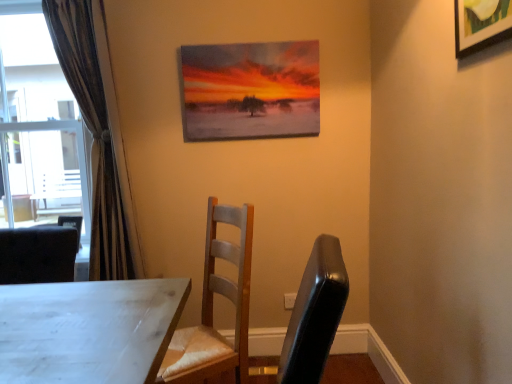
Question: Does wooden chair at center appear on the right side of oil painting at upper center, which appears as the 2th picture frame when viewed from the right?

Choices:
 (A) yes
 (B) no

Answer: (B)

Question: Is oil painting at upper center, the 1th picture frame positioned from the back, inside wooden chair at center?

Choices:
 (A) no
 (B) yes

Answer: (A)

Question: Is wooden chair at center shorter than oil painting at upper center, the 1th picture frame positioned from the back?

Choices:
 (A) no
 (B) yes

Answer: (A)

Question: Is wooden chair at center far away from oil painting at upper center, the 1th picture frame positioned from the back?

Choices:
 (A) yes
 (B) no

Answer: (B)

Question: Could you tell me if wooden chair at center is facing oil painting at upper center, acting as the second picture frame starting from the front?

Choices:
 (A) yes
 (B) no

Answer: (B)

Question: From the image's perspective, is wooden chair at center beneath oil painting at upper center, which appears as the 2th picture frame when viewed from the right?

Choices:
 (A) yes
 (B) no

Answer: (A)

Question: Can you confirm if transparent glass window at left is bigger than brown textured curtain at left?

Choices:
 (A) no
 (B) yes

Answer: (B)

Question: Considering the relative sizes of transparent glass window at left and brown textured curtain at left in the image provided, is transparent glass window at left taller than brown textured curtain at left?

Choices:
 (A) yes
 (B) no

Answer: (B)

Question: Is transparent glass window at left facing away from brown textured curtain at left?

Choices:
 (A) no
 (B) yes

Answer: (A)

Question: From the image's perspective, is transparent glass window at left under brown textured curtain at left?

Choices:
 (A) yes
 (B) no

Answer: (B)

Question: Does transparent glass window at left have a greater width compared to brown textured curtain at left?

Choices:
 (A) no
 (B) yes

Answer: (B)

Question: Is transparent glass window at left oriented towards brown textured curtain at left?

Choices:
 (A) yes
 (B) no

Answer: (B)

Question: Is wooden picture frame at upper right, acting as the second picture frame starting from the left, with oil painting at upper center, which is counted as the first picture frame, starting from the left?

Choices:
 (A) no
 (B) yes

Answer: (A)